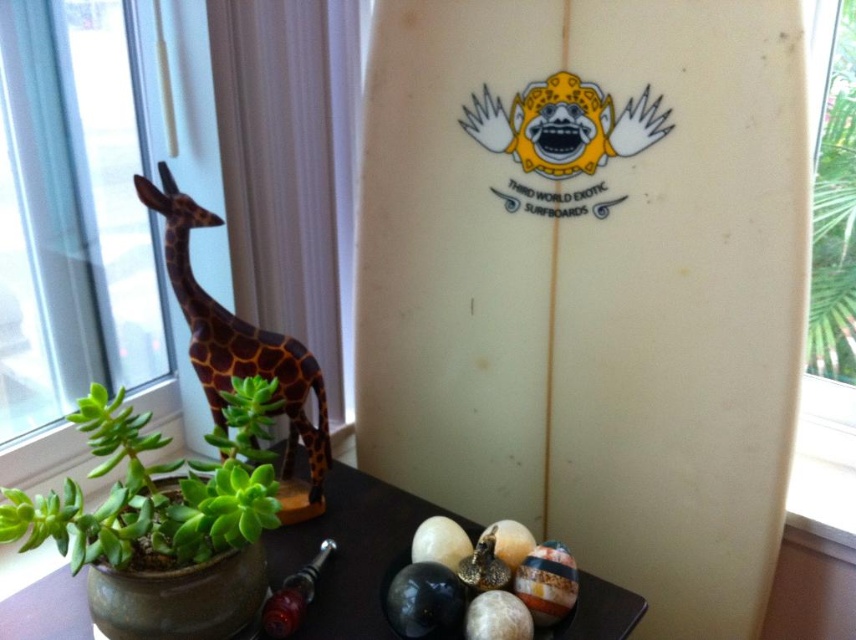
Is white matte surfboard at center below shiny red glass pipe at lower left?

Incorrect, white matte surfboard at center is not positioned below shiny red glass pipe at lower left.

From the picture: Does white matte surfboard at center come in front of shiny red glass pipe at lower left?

Yes, it is.

I want to click on white matte surfboard at center, so click(x=591, y=282).

At what (x,y) coordinates should I click in order to perform the action: click on white matte surfboard at center. Please return your answer as a coordinate pair (x, y). The height and width of the screenshot is (640, 856). Looking at the image, I should click on (591, 282).

Who is higher up, smooth dark wood table at lower center or shiny red glass pipe at lower left?

smooth dark wood table at lower center is higher up.

The width and height of the screenshot is (856, 640). I want to click on smooth dark wood table at lower center, so click(x=354, y=554).

Image resolution: width=856 pixels, height=640 pixels. I want to click on smooth dark wood table at lower center, so (x=354, y=554).

Is point (88, 442) positioned behind point (843, 221)?

Yes, point (88, 442) is farther from viewer.

Is green succulent at lower left below green leafy plant at upper right?

Indeed, green succulent at lower left is positioned under green leafy plant at upper right.

At what (x,y) coordinates should I click in order to perform the action: click on green succulent at lower left. Please return your answer as a coordinate pair (x, y). Looking at the image, I should click on (153, 488).